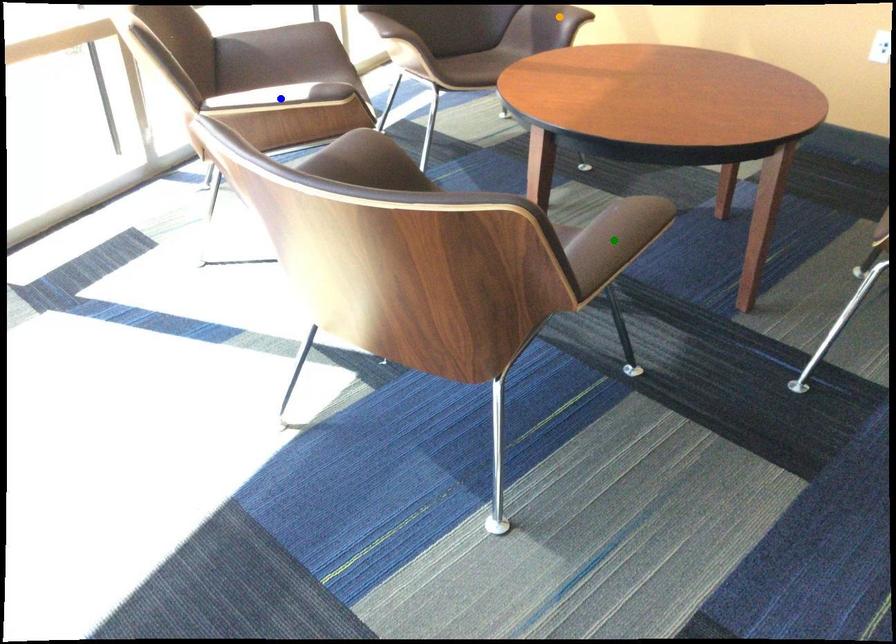
Order these from farthest to nearest:
- orange point
- blue point
- green point

1. orange point
2. blue point
3. green point